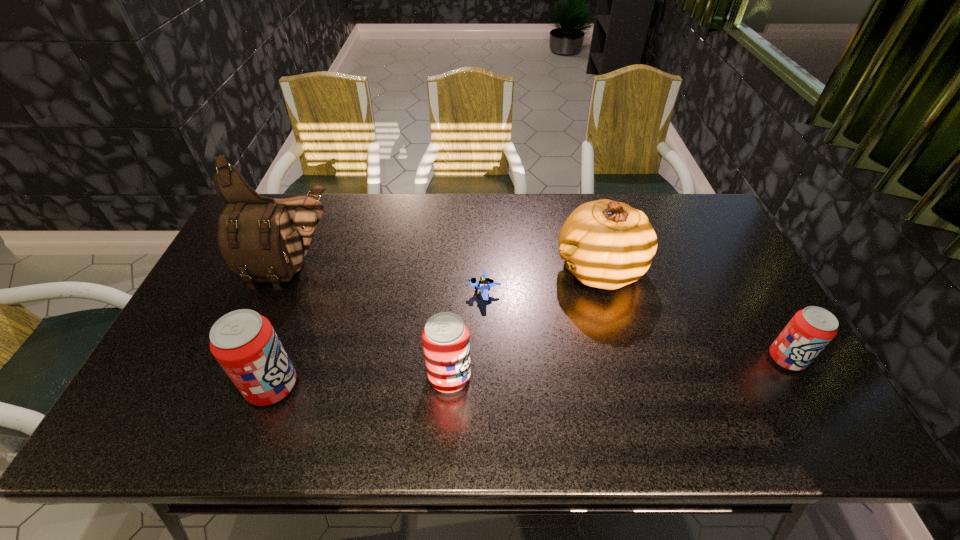
Identify the location of blank region between the Lego and the fifth object from left to right. (542, 281).

Where is `unoccupied area between the leftmost soda can and the rightmost soda can`? unoccupied area between the leftmost soda can and the rightmost soda can is located at coordinates (529, 372).

Find the location of `free space between the tallest object and the fifth object from left to right`. free space between the tallest object and the fifth object from left to right is located at coordinates pyautogui.click(x=446, y=269).

The height and width of the screenshot is (540, 960). What are the coordinates of `vacant area that lies between the leftmost soda can and the shoulder bag` in the screenshot? It's located at (283, 328).

Find the location of a particular element. object that is the closest one to the leftmost soda can is located at coordinates (262, 239).

Identify the location of object that can be found as the closest to the leftmost soda can. pos(262,239).

Where is `soda can that is the nearest to the shortest object`? soda can that is the nearest to the shortest object is located at coordinates pos(445,338).

Locate which soda can ranks third in proximity to the shoulder bag. Please provide its 2D coordinates. Your answer should be formatted as a tuple, i.e. [(x, y)], where the tuple contains the x and y coordinates of a point satisfying the conditions above.

[(810, 330)]

This screenshot has height=540, width=960. Find the location of `vacant position in the image that satisfies the following two spatial constraints: 1. on the surface of the rightmost object; 2. on the surface of the leftmost soda can`. vacant position in the image that satisfies the following two spatial constraints: 1. on the surface of the rightmost object; 2. on the surface of the leftmost soda can is located at coordinates (802, 386).

Find the location of `vacant space that satisfies the following two spatial constraints: 1. on the surface of the shortest soda can; 2. on the surface of the leftmost soda can`. vacant space that satisfies the following two spatial constraints: 1. on the surface of the shortest soda can; 2. on the surface of the leftmost soda can is located at coordinates (802, 386).